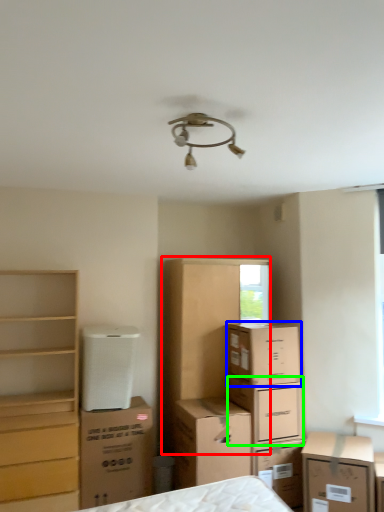
Question: Which object is positioned farthest from dresser (highlighted by a red box)? Select from cardboard box (highlighted by a blue box) and cardboard box (highlighted by a green box).

Choices:
 (A) cardboard box
 (B) cardboard box

Answer: (B)